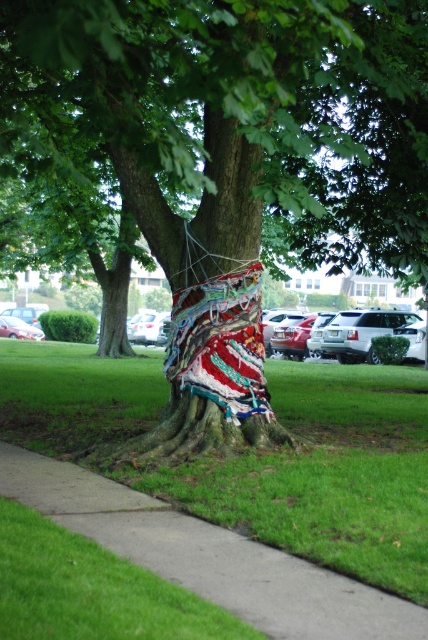
You are a gardener who needs to water the knitted fabric tree at center and the green grass at lower center. Your watering can holds enough water for 10 feet of distance. Can you water both without refilling?

The knitted fabric tree at center and green grass at lower center are 12.06 feet apart. Since the distance between them is greater than 10 feet, you cannot water both without refilling your watering can.

You are a gardener who wants to place a new flower pot between the knitted fabric tree at center and the green grass at lower center. Since the flower pot has a width of 1 meter, will it fit in the space between them?

The knitted fabric tree at center has a lesser width compared to green grass at lower center. Therefore, the flower pot with a width of 1 meter can fit between them as the space available is wider than the pot.